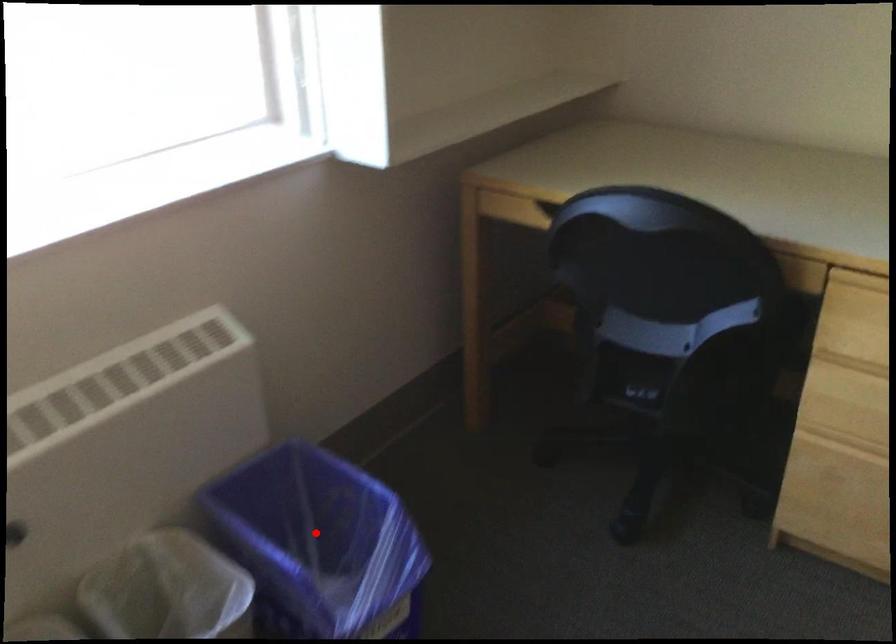
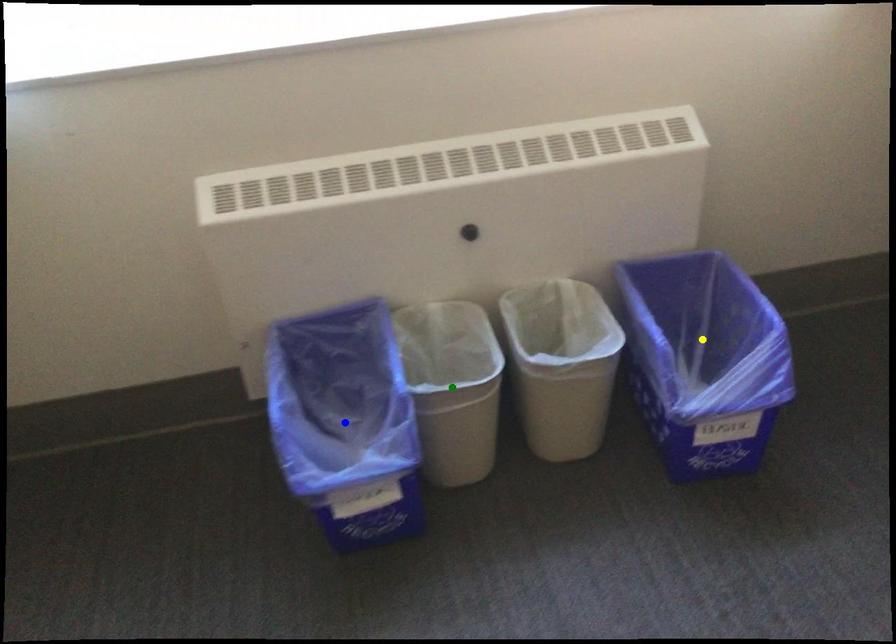
Question: I am providing you with two images of the same scene from different viewpoints. A red point is marked on the first image. You are given multiple points on the second image. Which spot in image 2 lines up with the point in image 1?

Choices:
 (A) blue point
 (B) yellow point
 (C) green point

Answer: (B)